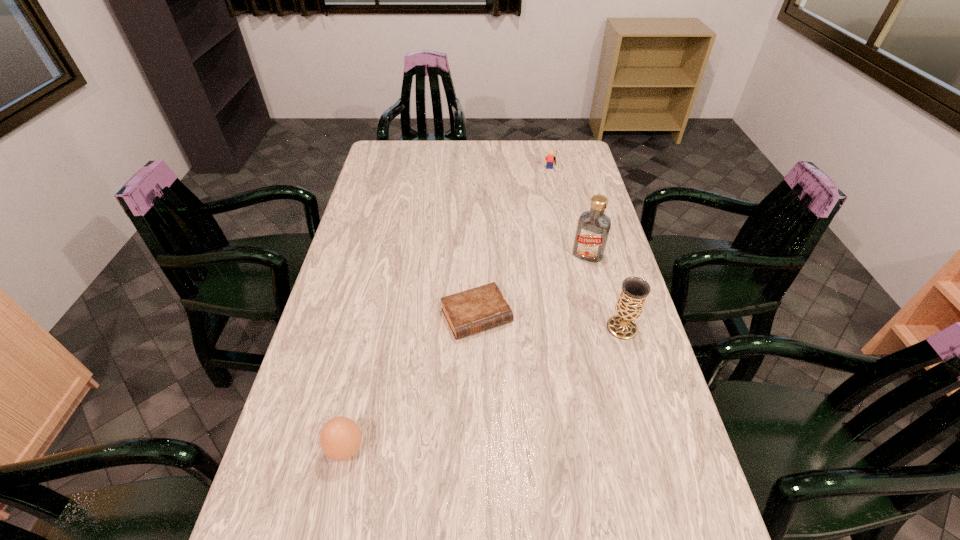
Identify which object is the fourth closest to the fourth object from right to left. Please provide its 2D coordinates. Your answer should be formatted as a tuple, i.e. [(x, y)], where the tuple contains the x and y coordinates of a point satisfying the conditions above.

[(550, 158)]

Find the location of a particular element. object that stands as the third closest to the diary is located at coordinates (340, 438).

Identify the location of free spot that satisfies the following two spatial constraints: 1. on the back side of the nearest object; 2. on the left side of the fourth shortest object. (372, 328).

Find the location of a particular element. The image size is (960, 540). free spot that satisfies the following two spatial constraints: 1. on the front side of the shortest object; 2. on the right side of the chalice is located at coordinates (476, 328).

Identify the location of vacant space that satisfies the following two spatial constraints: 1. on the back side of the second object from left to right; 2. on the right side of the farthest object. The width and height of the screenshot is (960, 540). (478, 171).